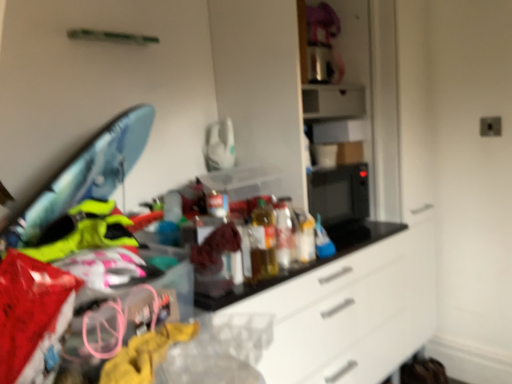
Question: Does point (263, 203) appear closer or farther from the camera than point (310, 94)?

Choices:
 (A) closer
 (B) farther

Answer: (A)

Question: From the image's perspective, relative to metallic silver toaster at upper center, is translucent plastic bottles at center above or below?

Choices:
 (A) above
 (B) below

Answer: (B)

Question: Is translucent plastic bottles at center to the left or to the right of metallic silver toaster at upper center in the image?

Choices:
 (A) right
 (B) left

Answer: (B)

Question: Relative to translucent plastic bottles at center, is metallic silver toaster at upper center in front or behind?

Choices:
 (A) behind
 (B) front

Answer: (A)

Question: Does point (316, 114) appear closer or farther from the camera than point (262, 274)?

Choices:
 (A) closer
 (B) farther

Answer: (B)

Question: Is metallic silver toaster at upper center inside or outside of translucent plastic bottles at center?

Choices:
 (A) outside
 (B) inside

Answer: (A)

Question: Is metallic silver toaster at upper center taller or shorter than translucent plastic bottles at center?

Choices:
 (A) short
 (B) tall

Answer: (A)